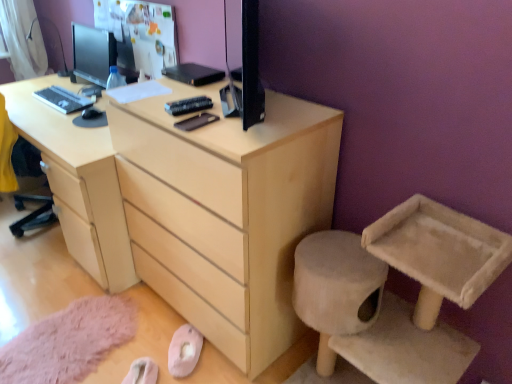
The height and width of the screenshot is (384, 512). Identify the location of vacant location below matte black keyboard at left (from a real-world perspective). [x=58, y=96].